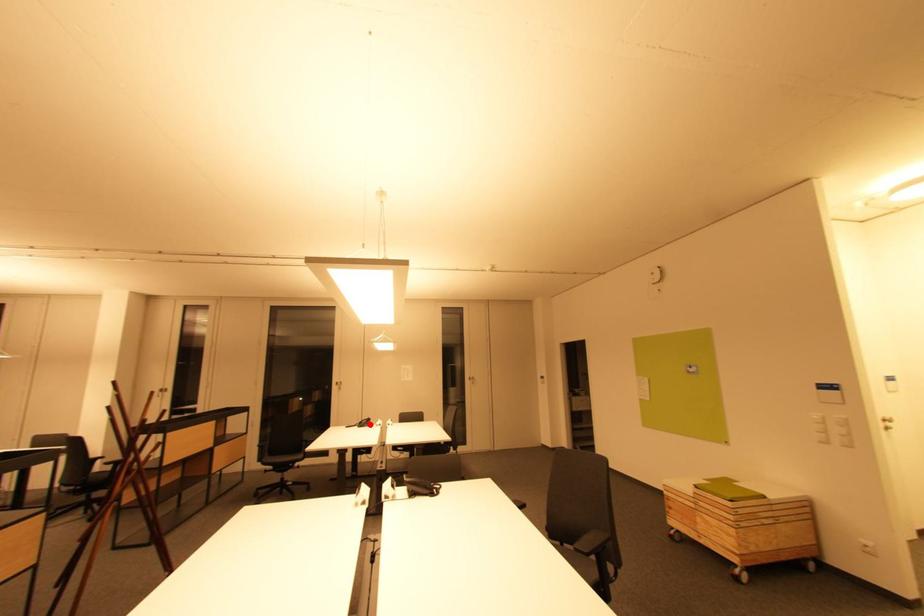
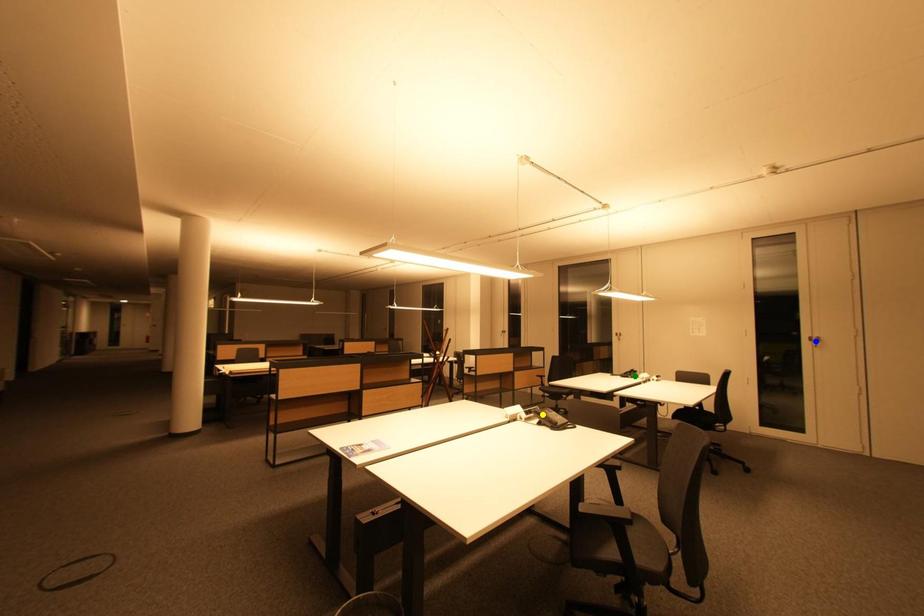
Question: I am providing you with two images of the same scene from different viewpoints. A red point is marked on the first image. You are given multiple points on the second image. Can you choose the point in image 2 that corresponds to the point in image 1?

Choices:
 (A) blue point
 (B) green point
 (C) yellow point

Answer: (B)